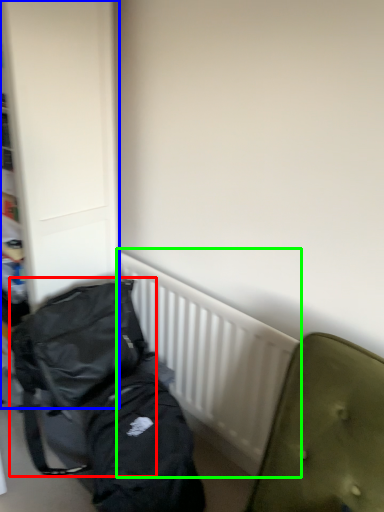
Question: Which object is the closest to the backpack (highlighted by a red box)? Choose among these: dresser (highlighted by a blue box) or radiator (highlighted by a green box).

Choices:
 (A) dresser
 (B) radiator

Answer: (B)